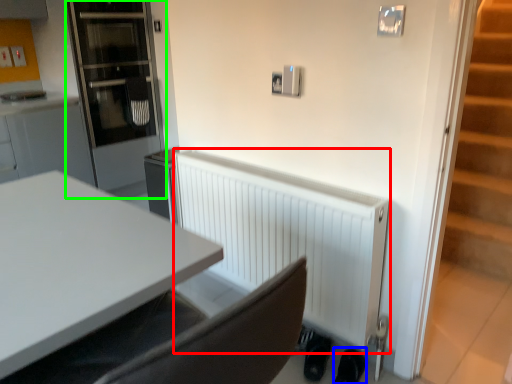
Question: Which is farther away from radiator (highlighted by a red box)? shoe (highlighted by a blue box) or glass door (highlighted by a green box)?

Choices:
 (A) shoe
 (B) glass door

Answer: (B)